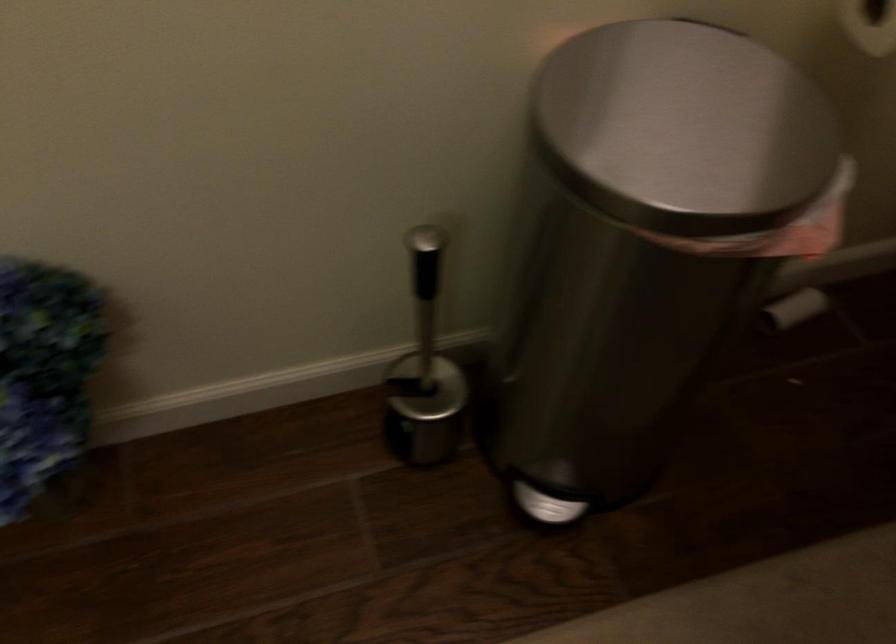
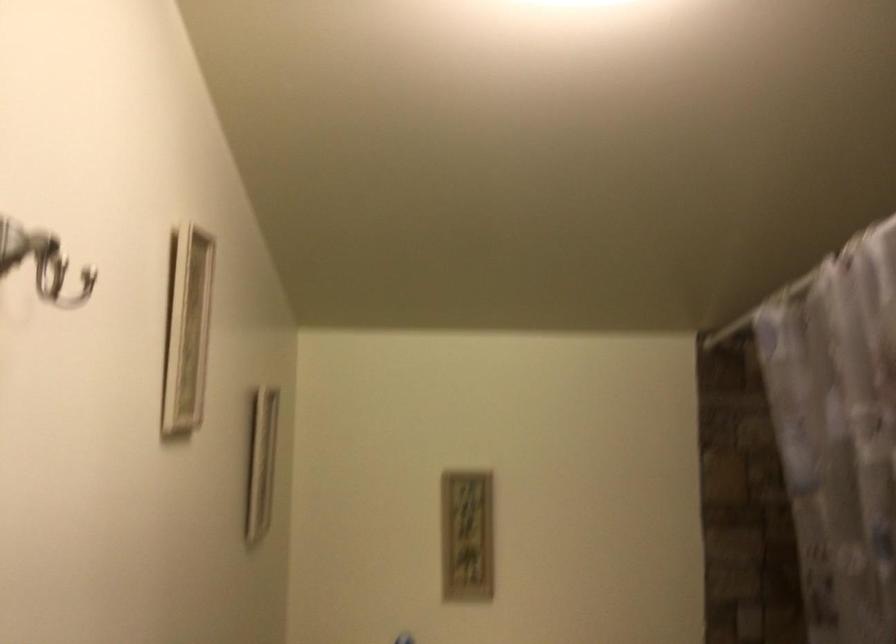
Based on the continuous images, in which direction is the camera rotating?

The camera rotated toward right-up.